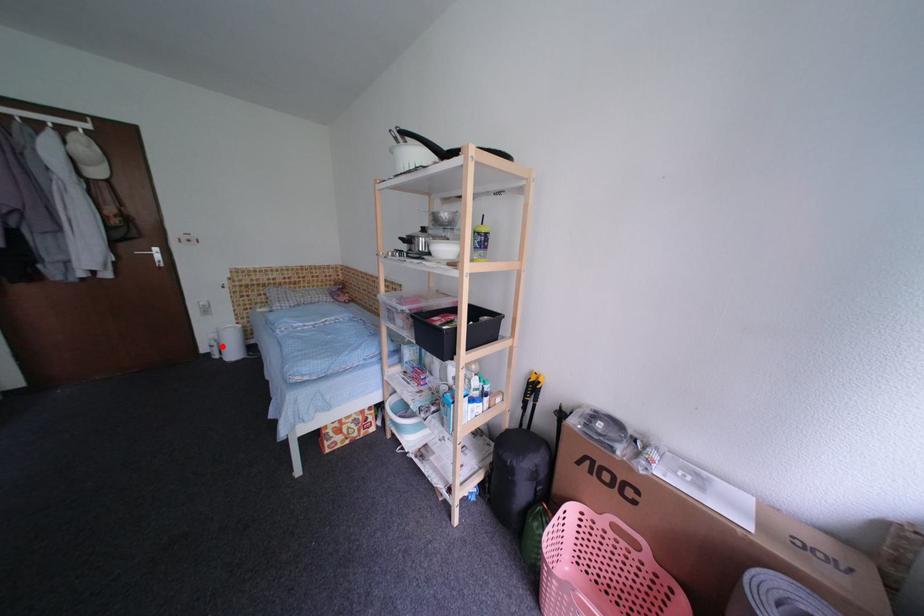
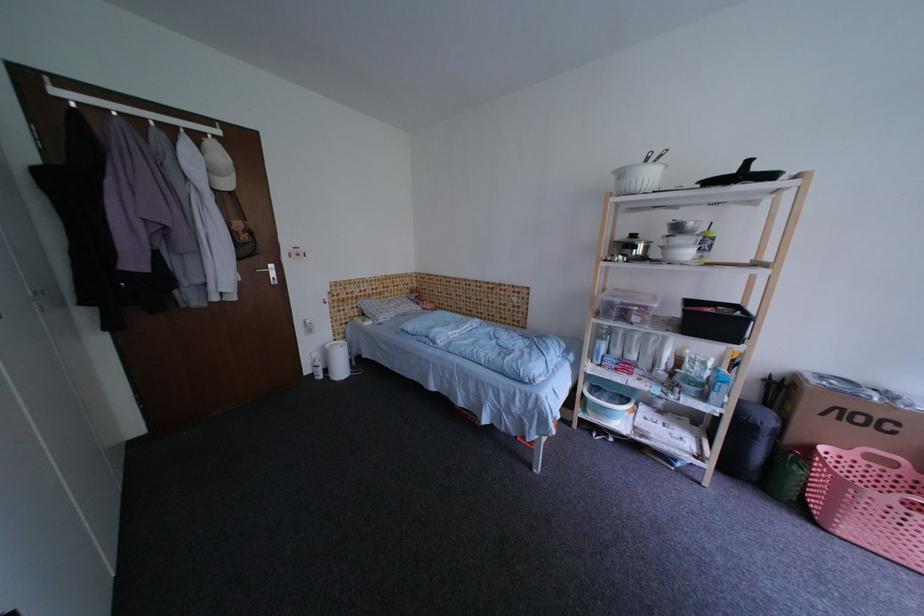
Question: I am providing you with two images of the same scene from different viewpoints. A red point is marked on the first image. At the location where the point appears in image 1, is it still visible in image 2?

Choices:
 (A) Yes
 (B) No

Answer: (A)